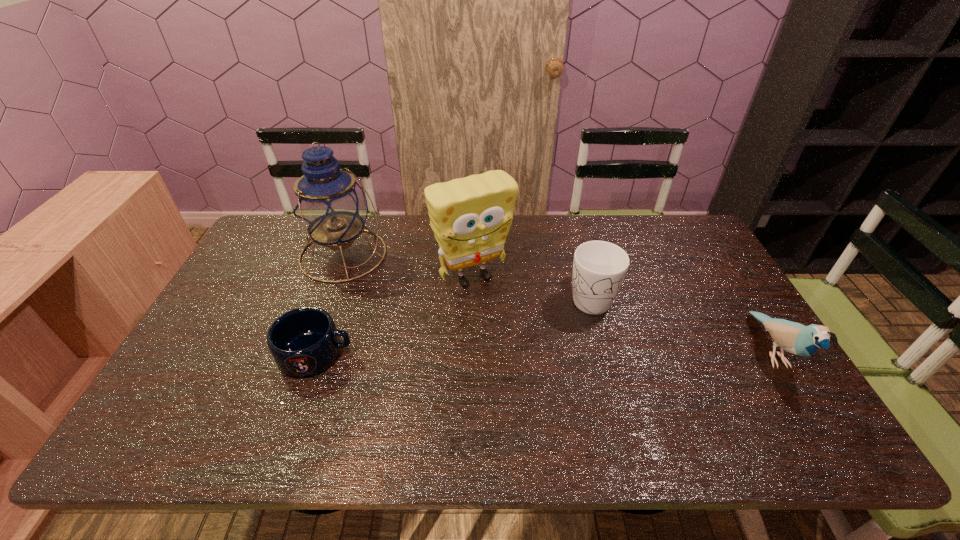
I want to click on vacant area that satisfies the following two spatial constraints: 1. on the front side of the shortest object; 2. with the handle on the side of the tallest object, so click(x=307, y=353).

In order to click on free spot that satisfies the following two spatial constraints: 1. on the front side of the sponge; 2. on the right side of the right mug in this screenshot , I will do coord(472,296).